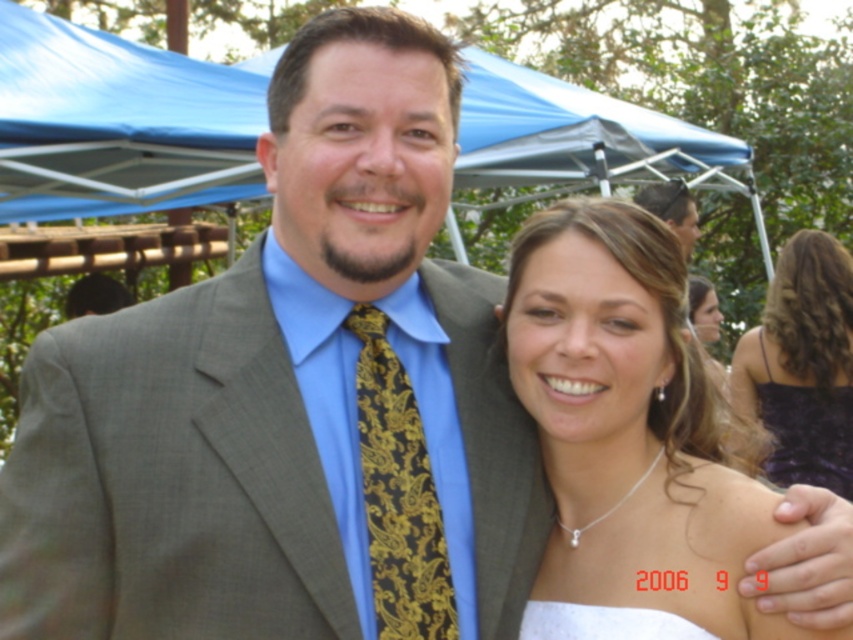
Question: Is white satin dress at center above white satin dress at lower right?

Choices:
 (A) yes
 (B) no

Answer: (A)

Question: Which object is closer to the camera taking this photo?

Choices:
 (A) white satin dress at lower right
 (B) gold paisley tie at center
 (C) purple satin dress at right

Answer: (B)

Question: Which point is closer to the camera taking this photo?

Choices:
 (A) (386, 589)
 (B) (303, 484)

Answer: (A)

Question: Does white satin dress at center have a lesser width compared to matte gray suit at center?

Choices:
 (A) yes
 (B) no

Answer: (B)

Question: Observing the image, what is the correct spatial positioning of purple satin dress at right in reference to white satin dress at lower right?

Choices:
 (A) above
 (B) below

Answer: (A)

Question: Which is nearer to the white satin dress at lower right?

Choices:
 (A) purple satin dress at right
 (B) matte gray suit at center
 (C) white satin dress at center

Answer: (C)